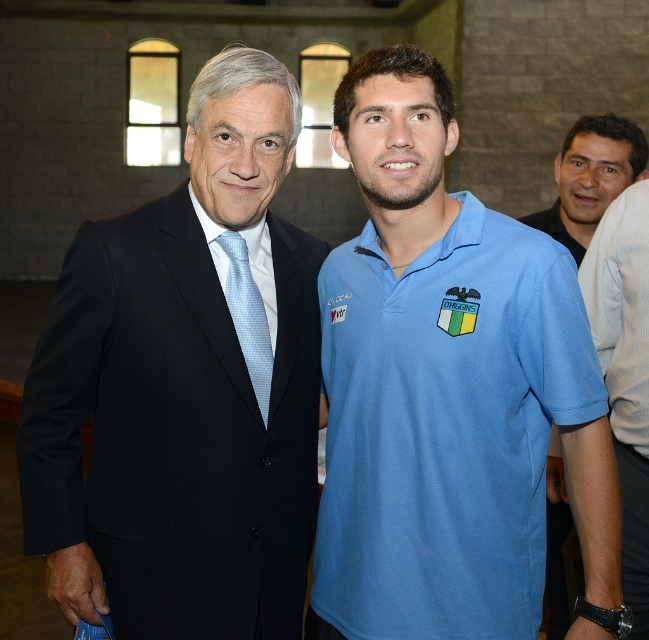
Is light blue cotton polo shirt at center smaller than blue fabric shirt at right?

No.

Does light blue cotton polo shirt at center have a greater width compared to blue fabric shirt at right?

Yes.

Image resolution: width=649 pixels, height=640 pixels. I want to click on light blue cotton polo shirt at center, so click(x=445, y=428).

You are a GUI agent. You are given a task and a screenshot of the screen. Output one action in this format:
    pyautogui.click(x=<x>, y=<y>)
    Task: Click on the light blue cotton polo shirt at center
    
    Given the screenshot: What is the action you would take?
    pyautogui.click(x=445, y=428)

Is light blue cotton polo shirt at center to the right of smooth black shirt at right from the viewer's perspective?

Incorrect, light blue cotton polo shirt at center is not on the right side of smooth black shirt at right.

Does point (495, 579) come farther from viewer compared to point (613, 122)?

No.

I want to click on light blue cotton polo shirt at center, so click(x=445, y=428).

Based on the photo, does matte black suit at left have a smaller size compared to light blue cotton polo shirt at center?

No.

Which of these two, matte black suit at left or light blue cotton polo shirt at center, stands taller?

With more height is matte black suit at left.

At what (x,y) coordinates should I click in order to perform the action: click on matte black suit at left. Please return your answer as a coordinate pair (x, y). Looking at the image, I should click on (184, 387).

Find the location of a particular element. matte black suit at left is located at coordinates (184, 387).